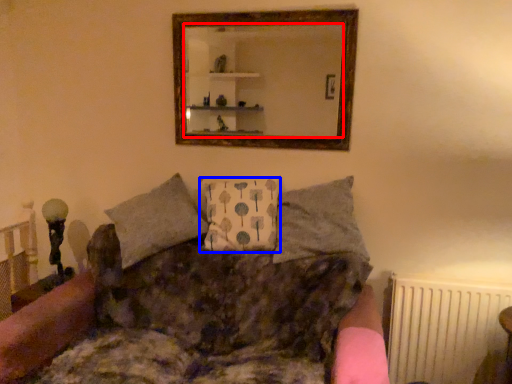
Question: Which point is further to the camera, mirror (highlighted by a red box) or pillow (highlighted by a blue box)?

Choices:
 (A) mirror
 (B) pillow

Answer: (A)